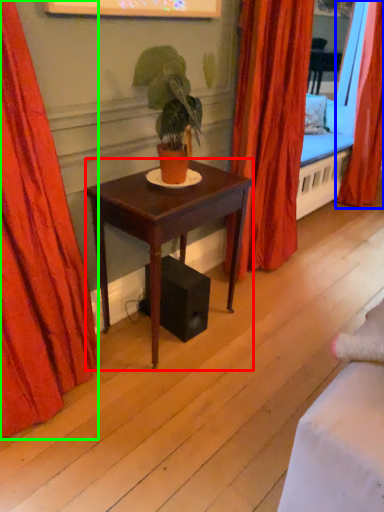
Question: Considering the real-world distances, which object is closest to desk (highlighted by a red box)? curtain (highlighted by a blue box) or curtain (highlighted by a green box).

Choices:
 (A) curtain
 (B) curtain

Answer: (B)